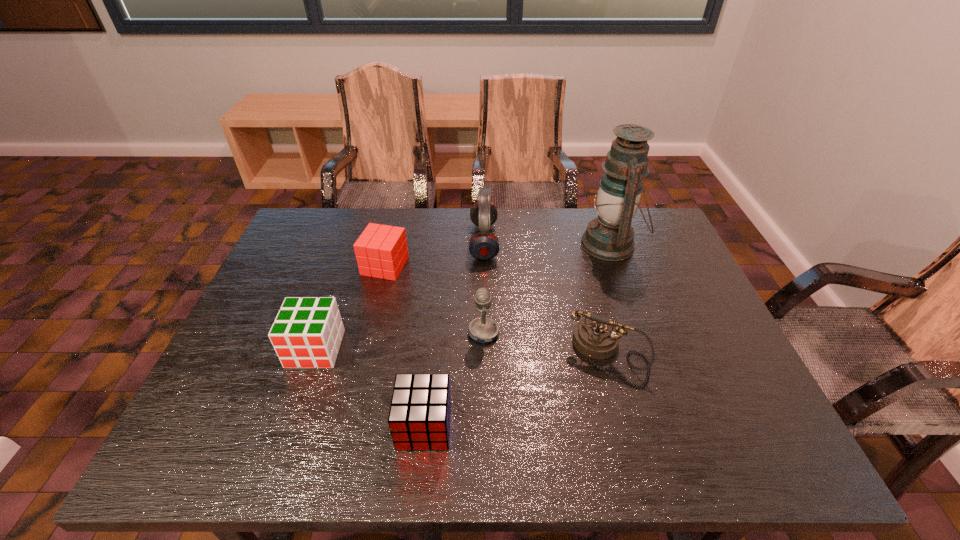
The height and width of the screenshot is (540, 960). I want to click on unoccupied area between the telephone and the earphone, so click(x=545, y=298).

Identify which object is located as the nearest to the telephone. Please provide its 2D coordinates. Your answer should be formatted as a tuple, i.e. [(x, y)], where the tuple contains the x and y coordinates of a point satisfying the conditions above.

[(482, 329)]

Locate which object is the second closest to the telephone. Please provide its 2D coordinates. Your answer should be formatted as a tuple, i.e. [(x, y)], where the tuple contains the x and y coordinates of a point satisfying the conditions above.

[(609, 237)]

Find the location of a particular element. The width and height of the screenshot is (960, 540). the second closest cube to the fifth object from right to left is located at coordinates (381, 251).

Identify the location of cube that is the third nearest to the earphone. (419, 418).

Find the location of a particular element. free space that satisfies the following two spatial constraints: 1. on the front-facing side of the telephone; 2. on the left side of the fifth shortest object is located at coordinates (484, 355).

This screenshot has width=960, height=540. In order to click on vacant space that satisfies the following two spatial constraints: 1. on the back side of the rightmost cube; 2. on the right side of the telephone in this screenshot , I will do `click(431, 355)`.